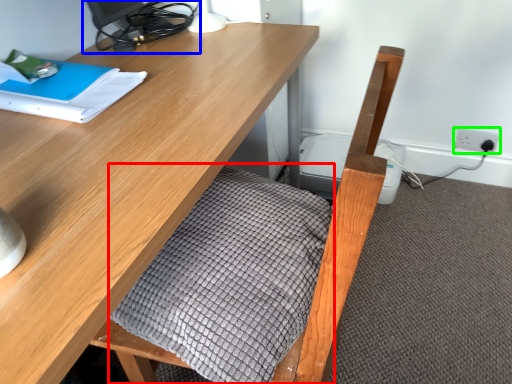
Question: Based on their relative distances, which object is farther from blanket (highlighted by a red box)? Choose from desktop (highlighted by a blue box) and electric outlet (highlighted by a green box).

Choices:
 (A) desktop
 (B) electric outlet

Answer: (B)